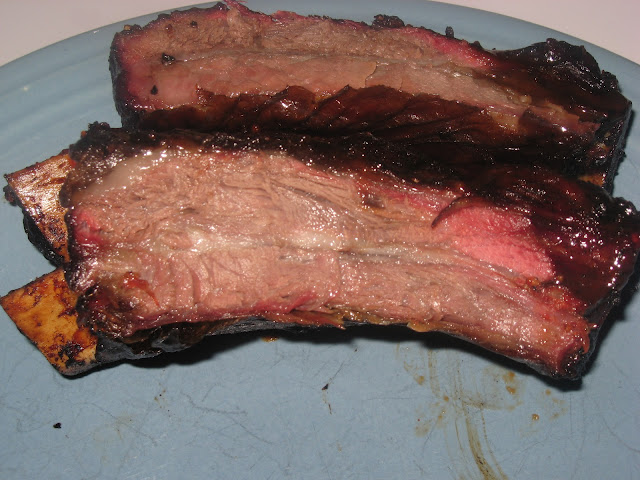
You are a GUI agent. You are given a task and a screenshot of the screen. Output one action in this format:
    pyautogui.click(x=<x>, y=<y>)
    Task: Click on the sauce on plate
    The height and width of the screenshot is (480, 640).
    Given the screenshot: What is the action you would take?
    pyautogui.click(x=482, y=463), pyautogui.click(x=511, y=386)